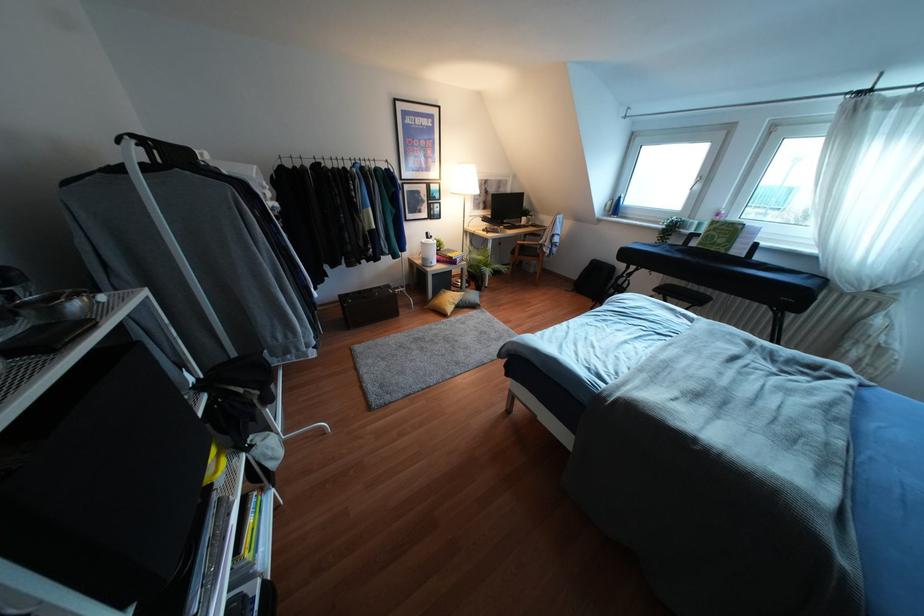
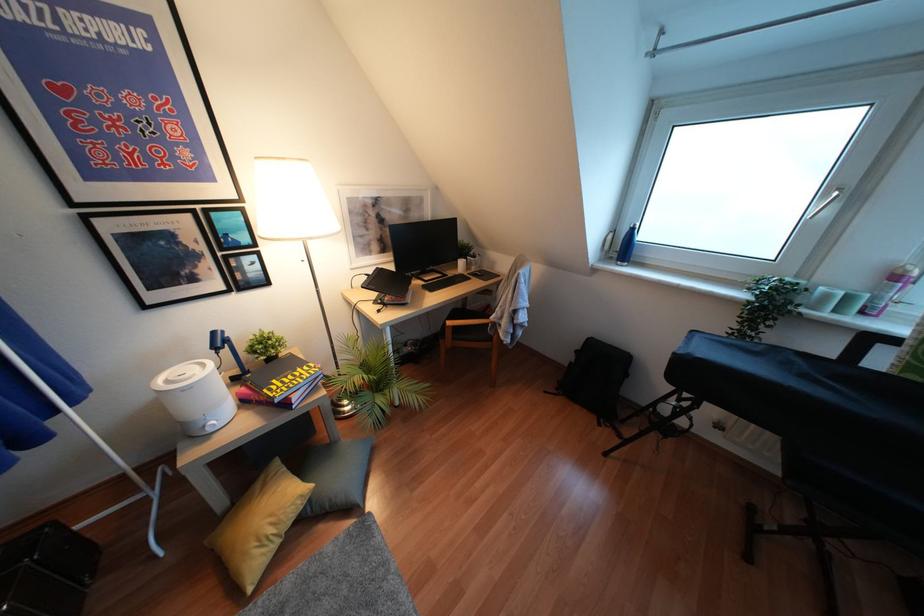
Which direction would the cameraman need to move to produce the second image?

The cameraman walked toward right, forward.